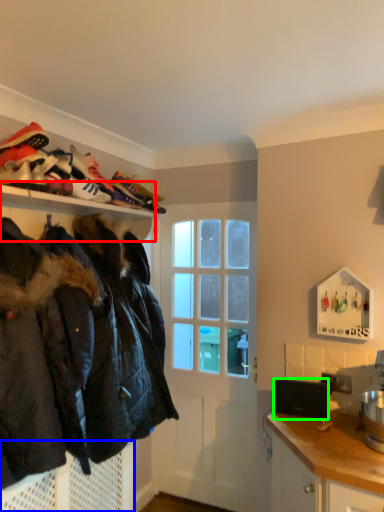
Question: Considering the real-world distances, which object is farthest from shelf (highlighted by a red box)? cabinetry (highlighted by a blue box) or laptop (highlighted by a green box)?

Choices:
 (A) cabinetry
 (B) laptop

Answer: (B)